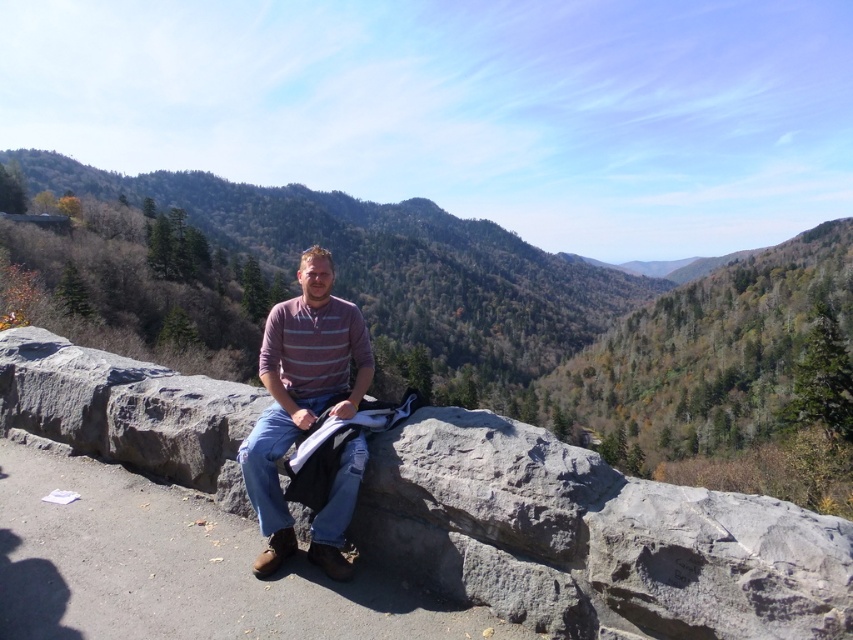
Question: Considering the relative positions of gray rough stone at center and striped cotton shirt at center in the image provided, where is gray rough stone at center located with respect to striped cotton shirt at center?

Choices:
 (A) above
 (B) below

Answer: (B)

Question: Where is gray rough stone at center located in relation to striped cotton shirt at center in the image?

Choices:
 (A) below
 (B) above

Answer: (A)

Question: Which point is farther to the camera?

Choices:
 (A) (758, 576)
 (B) (288, 403)

Answer: (B)

Question: Which point is closer to the camera taking this photo?

Choices:
 (A) (587, 624)
 (B) (270, 451)

Answer: (A)

Question: Is gray rough stone at center further to camera compared to striped cotton shirt at center?

Choices:
 (A) no
 (B) yes

Answer: (A)

Question: Which point appears farthest from the camera in this image?

Choices:
 (A) (265, 468)
 (B) (741, 592)

Answer: (A)